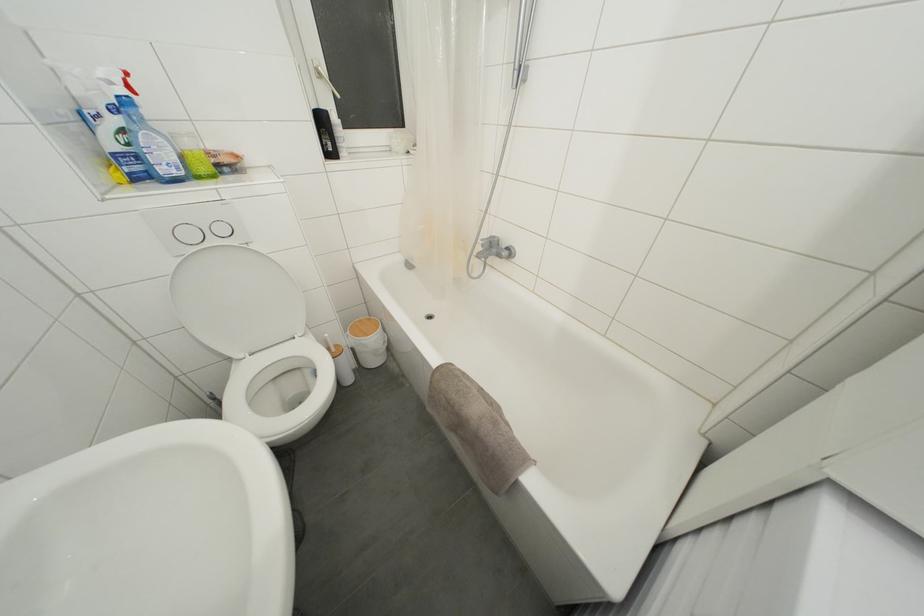
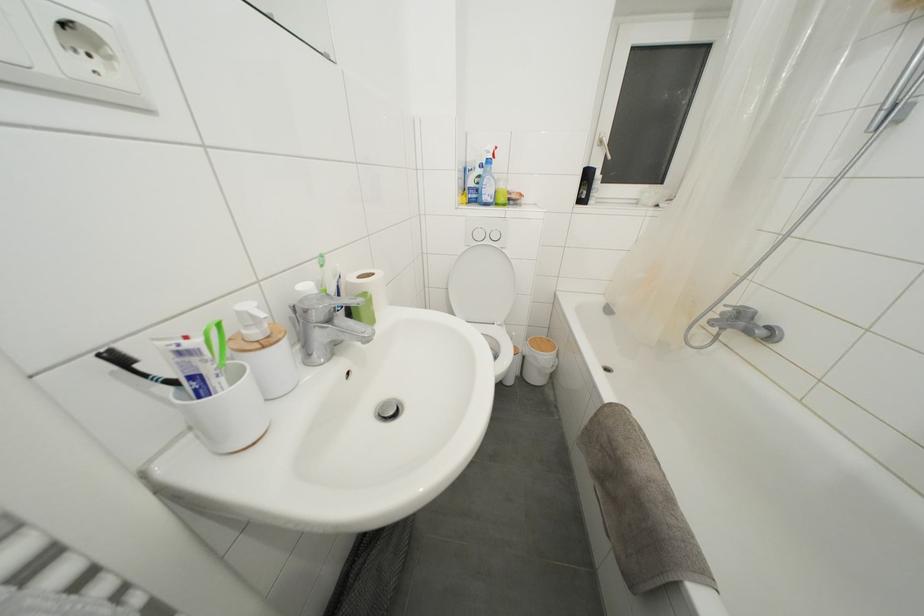
Locate, in the second image, the point that corresponds to [249,254] in the first image.

(505, 256)